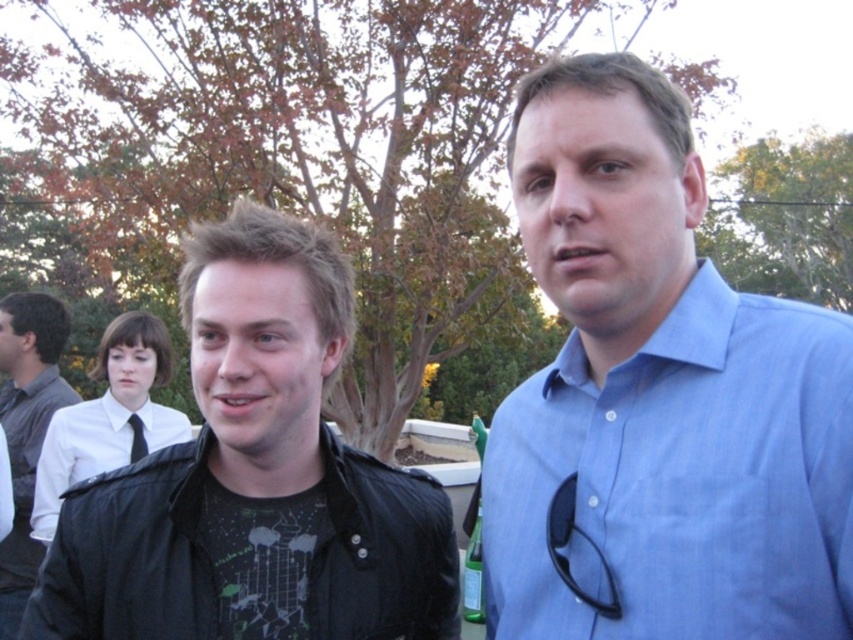
You are organizing a clothing display and need to arrange the blue cotton shirt at upper right and the white smooth shirt at upper left based on their sizes. Which shirt should you place on the smaller hanger?

The blue cotton shirt at upper right should be placed on the smaller hanger because its width is less than the white smooth shirt at upper left.

You are a photographer at the event and need to decide which object to focus on. Since the black leather jacket at lower left and the black silk tie at center are both in your frame, which one would you choose if you want to capture a wider object?

The black leather jacket at lower left is wider than the black silk tie at center, so you should focus on the black leather jacket at lower left to capture a wider object.